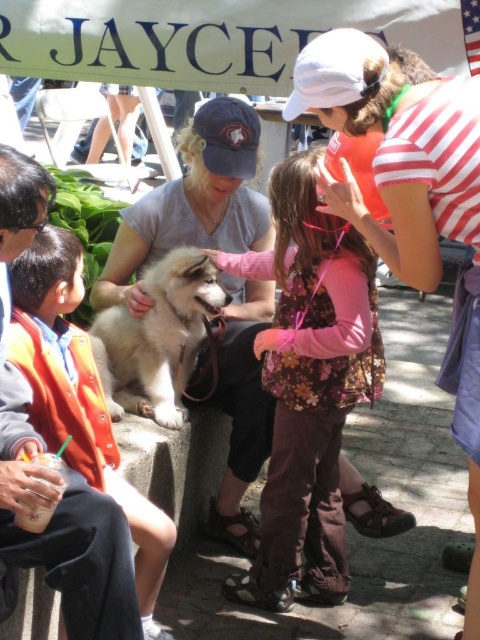
In order to click on floral fabric vest at center in this screenshot , I will do `click(309, 387)`.

Is floral fabric vest at center shorter than orange fleece vest at left?

Incorrect, floral fabric vest at center's height does not fall short of orange fleece vest at left's.

The image size is (480, 640). What do you see at coordinates (309, 387) in the screenshot?
I see `floral fabric vest at center` at bounding box center [309, 387].

Locate an element on the screen. floral fabric vest at center is located at coordinates (309, 387).

Locate an element on the screen. This screenshot has height=640, width=480. orange fleece vest at left is located at coordinates pos(74,397).

Describe the element at coordinates (74, 397) in the screenshot. I see `orange fleece vest at left` at that location.

This screenshot has height=640, width=480. Identify the location of orange fleece vest at left. (74, 397).

Can you confirm if floral fabric vest at center is taller than white fluffy dog at center?

Correct, floral fabric vest at center is much taller as white fluffy dog at center.

Is point (324, 554) closer to camera compared to point (126, 342)?

Yes, point (324, 554) is closer to viewer.

This screenshot has height=640, width=480. Identify the location of floral fabric vest at center. (309, 387).